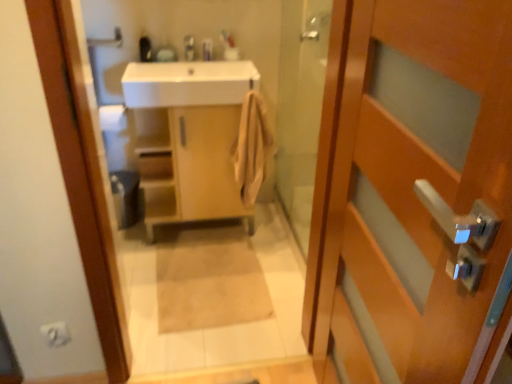
Measure the distance between point (134, 102) and camera.

Point (134, 102) is 2.04 meters away from camera.

Identify the location of wooden door at right. (412, 192).

Measure the distance between beige cotton towel at center and camera.

beige cotton towel at center is 6.55 feet away from camera.

Identify the location of light wood cabinet at center. (191, 168).

Considering the relative sizes of matte silver faucet at upper center and matte wooden mirror at upper center in the image provided, is matte silver faucet at upper center wider than matte wooden mirror at upper center?

Incorrect, the width of matte silver faucet at upper center does not surpass that of matte wooden mirror at upper center.

From a real-world perspective, which object stands above the other?

matte silver faucet at upper center.

Considering the sizes of matte silver faucet at upper center and matte wooden mirror at upper center in the image, is matte silver faucet at upper center taller or shorter than matte wooden mirror at upper center?

Clearly, matte silver faucet at upper center is shorter compared to matte wooden mirror at upper center.

Would you say matte silver faucet at upper center is a long distance from matte wooden mirror at upper center?

No.

Is matte plastic toothbrush at upper center thinner than light wood cabinet at center?

Correct, the width of matte plastic toothbrush at upper center is less than that of light wood cabinet at center.

From the image's perspective, is matte plastic toothbrush at upper center on light wood cabinet at center?

Correct, matte plastic toothbrush at upper center appears higher than light wood cabinet at center in the image.

Which of these two, matte plastic toothbrush at upper center or light wood cabinet at center, stands taller?

With more height is light wood cabinet at center.

Is point (211, 55) behind point (180, 198)?

That is False.

Does point (256, 282) lie in front of point (188, 44)?

Yes, point (256, 282) is closer to viewer.

Is beige fabric bath mat at center spatially inside matte silver faucet at upper center, or outside of it?

beige fabric bath mat at center is spatially situated outside matte silver faucet at upper center.

Is the surface of beige fabric bath mat at center in direct contact with matte silver faucet at upper center?

No, beige fabric bath mat at center is not making contact with matte silver faucet at upper center.

How far apart are beige fabric bath mat at center and matte silver faucet at upper center?

beige fabric bath mat at center is 3.73 feet away from matte silver faucet at upper center.

Considering the relative positions of matte plastic toothbrush at upper center and wooden door at right in the image provided, is matte plastic toothbrush at upper center to the left of wooden door at right from the viewer's perspective?

Yes, matte plastic toothbrush at upper center is to the left of wooden door at right.

Considering the points (204, 49) and (493, 90), which point is in front, point (204, 49) or point (493, 90)?

Positioned in front is point (493, 90).

Does matte silver faucet at upper center come in front of beige cotton towel at center?

No.

Could you tell me if matte silver faucet at upper center is turned towards beige cotton towel at center?

No.

Considering the positions of point (194, 50) and point (251, 202), is point (194, 50) closer or farther from the camera than point (251, 202)?

Point (194, 50) appears to be closer to the viewer than point (251, 202).

In the image, there is a wooden door at right. Identify the location of bath mat below it (from a real-world perspective). (208, 279).

Is beige fabric bath mat at center thinner than wooden door at right?

Incorrect, the width of beige fabric bath mat at center is not less than that of wooden door at right.

Does point (255, 307) come farther from viewer compared to point (337, 361)?

Yes, point (255, 307) is behind point (337, 361).

Considering the relative sizes of beige fabric bath mat at center and wooden door at right in the image provided, is beige fabric bath mat at center shorter than wooden door at right?

Yes, beige fabric bath mat at center is shorter than wooden door at right.

Considering the positions of objects beige cotton towel at center and matte plastic toothbrush at upper center in the image provided, who is more to the right, beige cotton towel at center or matte plastic toothbrush at upper center?

From the viewer's perspective, beige cotton towel at center appears more on the right side.

Is beige cotton towel at center oriented away from matte plastic toothbrush at upper center?

No, beige cotton towel at center is not facing the opposite direction of matte plastic toothbrush at upper center.

Are beige cotton towel at center and matte plastic toothbrush at upper center located far from each other?

beige cotton towel at center is near matte plastic toothbrush at upper center, not far away.

The height and width of the screenshot is (384, 512). Find the location of `mirror in front of the matte silver faucet at upper center`. mirror in front of the matte silver faucet at upper center is located at coordinates (203, 253).

This screenshot has width=512, height=384. What are the coordinates of `cabinetry that appears below the matte plastic toothbrush at upper center (from the image's perspective)` in the screenshot? It's located at (191, 168).

Based on their spatial positions, is beige fabric bath mat at center or wooden door at right further from beige cotton towel at center?

Among the two, wooden door at right is located further to beige cotton towel at center.

Considering their positions, is matte silver faucet at upper center positioned closer to matte plastic toothbrush at upper center than wooden door at right?

matte silver faucet at upper center.

From the image, which object appears to be nearer to beige fabric bath mat at center, matte wooden mirror at upper center or matte plastic toothbrush at upper center?

matte wooden mirror at upper center.

Estimate the real-world distances between objects in this image. Which object is further from light wood cabinet at center, white matte toilet paper at lower left or matte wooden mirror at upper center?

white matte toilet paper at lower left lies further to light wood cabinet at center than the other object.

Looking at the image, which one is located closer to wooden door at right, beige cotton towel at center or beige fabric bath mat at center?

beige fabric bath mat at center is positioned closer to the anchor wooden door at right.

Based on their spatial positions, is matte silver faucet at upper center or white glossy sink at upper center further from white matte toilet paper at lower left?

Based on the image, matte silver faucet at upper center appears to be further to white matte toilet paper at lower left.

When comparing their distances from beige cotton towel at center, does wooden door at right or white matte toilet paper at lower left seem further?

white matte toilet paper at lower left lies further to beige cotton towel at center than the other object.

Looking at the image, which one is located closer to white matte toilet paper at lower left, matte plastic toothbrush at upper center or matte silver faucet at upper center?

Among the two, matte silver faucet at upper center is located nearer to white matte toilet paper at lower left.

Where is `toiletry between matte silver faucet at upper center and beige fabric bath mat at center in the up-down direction`? The image size is (512, 384). toiletry between matte silver faucet at upper center and beige fabric bath mat at center in the up-down direction is located at coordinates (207, 49).

Identify the location of bath mat between wooden door at right and beige cotton towel at center along the z-axis. The image size is (512, 384). pyautogui.click(x=208, y=279).

Identify the location of tap between wooden door at right and matte plastic toothbrush at upper center from front to back. This screenshot has height=384, width=512. (189, 47).

Locate an element on the screen. bath towel between matte plastic toothbrush at upper center and white matte toilet paper at lower left from top to bottom is located at coordinates (252, 147).